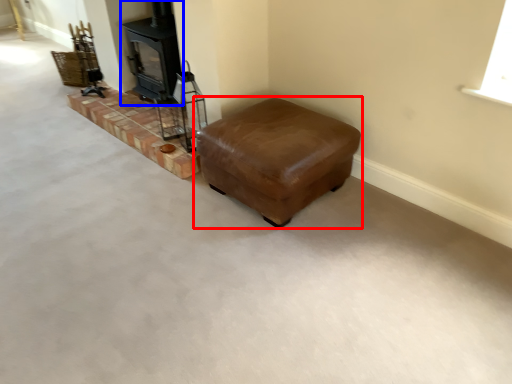
Question: Which object is closer to the camera taking this photo, furniture (highlighted by a red box) or wood burning stove (highlighted by a blue box)?

Choices:
 (A) furniture
 (B) wood burning stove

Answer: (A)